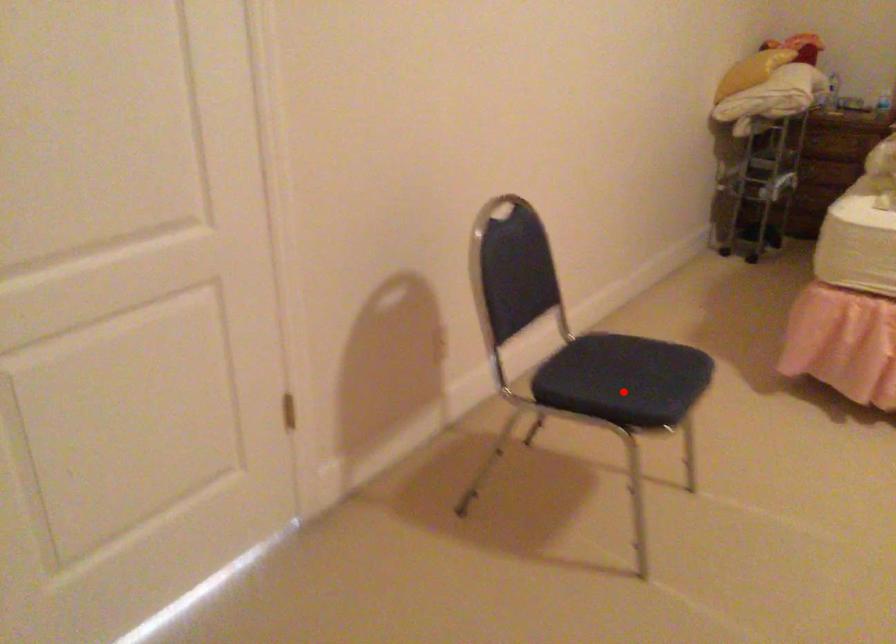
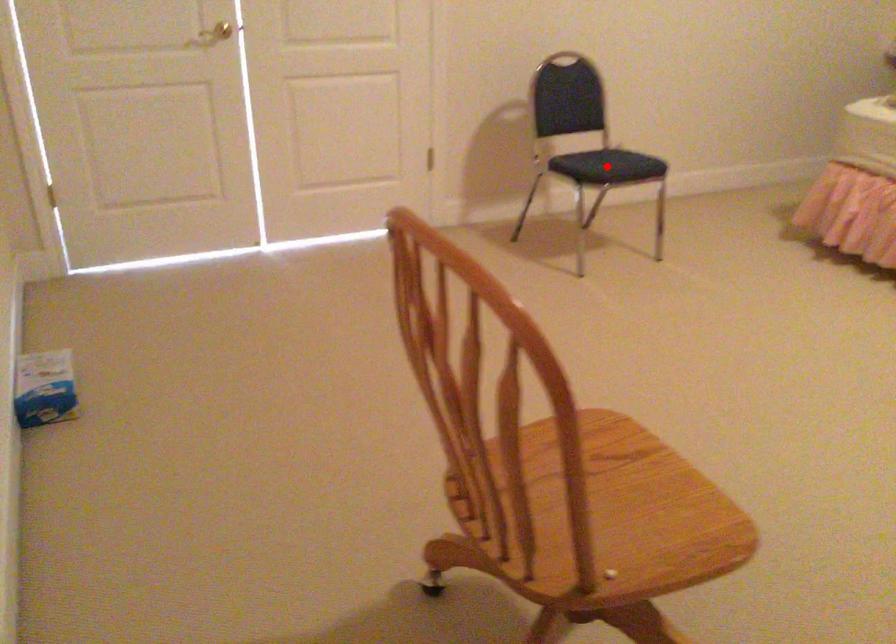
I am providing you with two images of the same scene from different viewpoints. A red point is marked on the first image and another point is marked on the second image. Does the point marked in image1 correspond to the same location as the one in image2?

Yes